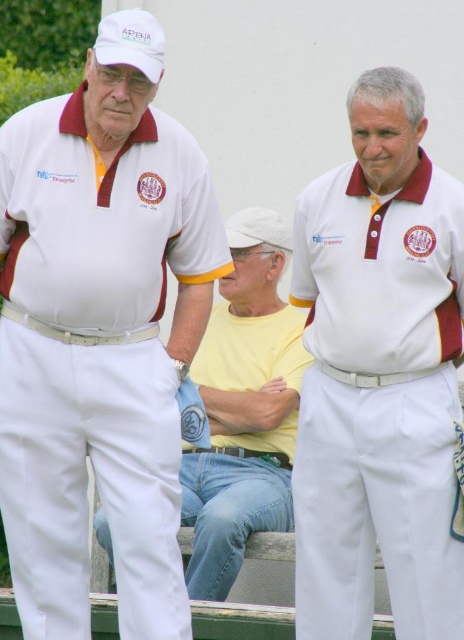
You are a photographer at a sports event and need to capture a clear shot of the white cotton polo shirt at center and the white matte polo shirt at center. Which one is positioned lower in the image?

The white cotton polo shirt at center is below the white matte polo shirt at center, so the white cotton polo shirt at center is positioned lower in the image.

You are a photographer at a sports event. You need to capture a photo of both the white cotton polo shirt at center and the yellow cotton shirt at center so that both are fully visible. Given their height difference, where should you position your camera to ensure both shirts are in frame without cropping?

The white cotton polo shirt at center is much taller than the yellow cotton shirt at center. To capture both fully, position the camera at a lower angle so that the shorter yellow cotton shirt at center isn t cropped and the taller white cotton polo shirt at center fits within the frame.